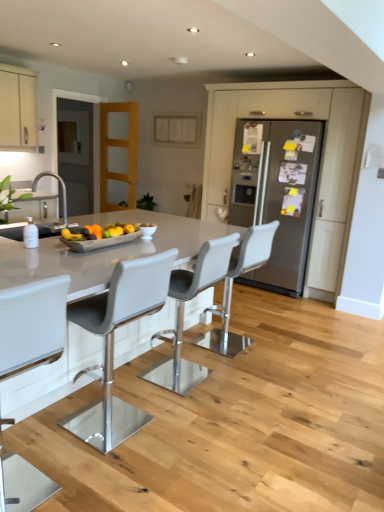
The height and width of the screenshot is (512, 384). I want to click on empty space that is to the right of white leather bar stool at center, acting as the 1th chair starting from the front, so click(100, 480).